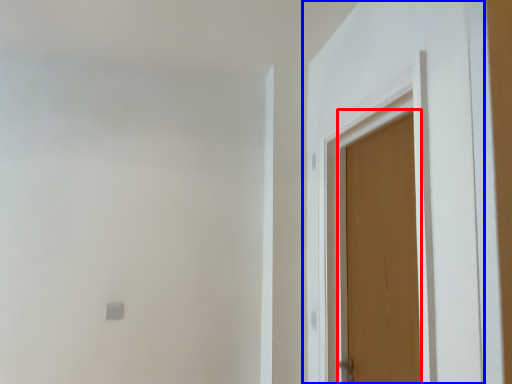
Question: Which point is further to the camera, door (highlighted by a red box) or door (highlighted by a blue box)?

Choices:
 (A) door
 (B) door

Answer: (A)